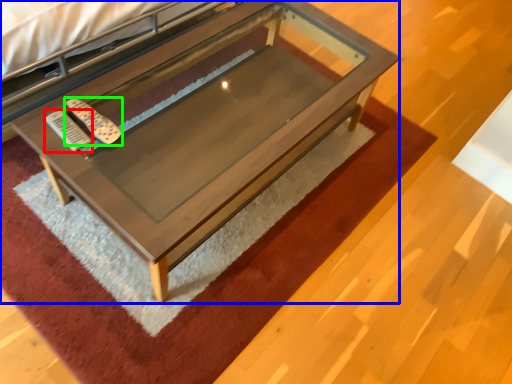
Question: Based on their relative distances, which object is farther from remote (highlighted by a red box)? Choose from table (highlighted by a blue box) and remote (highlighted by a green box).

Choices:
 (A) table
 (B) remote

Answer: (A)